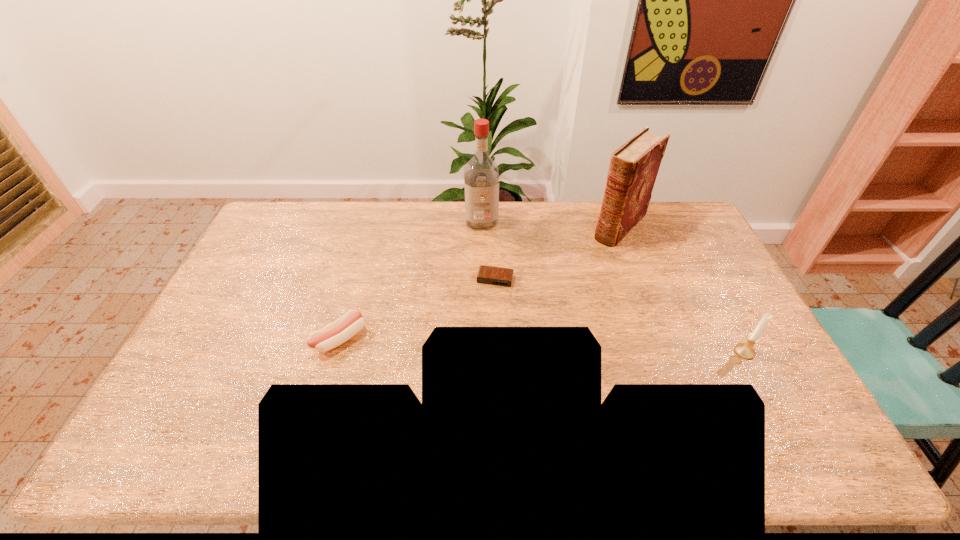
Image resolution: width=960 pixels, height=540 pixels. Identify the location of hardback book present at the far edge. (634, 166).

Locate an element on the screen. This screenshot has height=540, width=960. liquor that is at the far edge is located at coordinates (481, 176).

You are a GUI agent. You are given a task and a screenshot of the screen. Output one action in this format:
    pyautogui.click(x=<x>, y=<y>)
    Task: Click on the object that is at the right edge
    Image resolution: width=960 pixels, height=540 pixels.
    Given the screenshot: What is the action you would take?
    pyautogui.click(x=745, y=350)

In the image, there is a desktop. Identify the location of vacant area at the far edge. (516, 237).

This screenshot has width=960, height=540. In the image, there is a desktop. In order to click on vacant region at the near edge in this screenshot , I will do `click(312, 406)`.

Where is `free spot at the left edge of the desktop`? free spot at the left edge of the desktop is located at coordinates (223, 327).

Identify the location of blank space at the right edge of the desktop. (746, 328).

Find the location of `vacant space at the far left corner of the desktop`. vacant space at the far left corner of the desktop is located at coordinates (290, 203).

Find the location of a particular element. The image size is (960, 540). free space at the far right corner of the desktop is located at coordinates (671, 207).

Identify the location of free space at the near right corner. Image resolution: width=960 pixels, height=540 pixels. (742, 390).